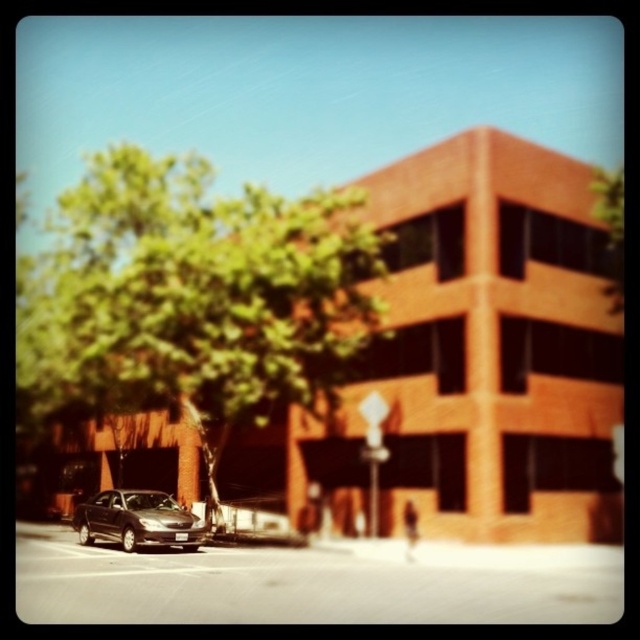
This screenshot has width=640, height=640. Describe the element at coordinates (192, 298) in the screenshot. I see `green leafy tree at upper left` at that location.

Is point (179, 304) less distant than point (172, 524)?

No, it is behind (172, 524).

Who is more distant from viewer, (x=193, y=326) or (x=83, y=540)?

Positioned behind is point (x=83, y=540).

The width and height of the screenshot is (640, 640). I want to click on green leafy tree at upper left, so click(192, 298).